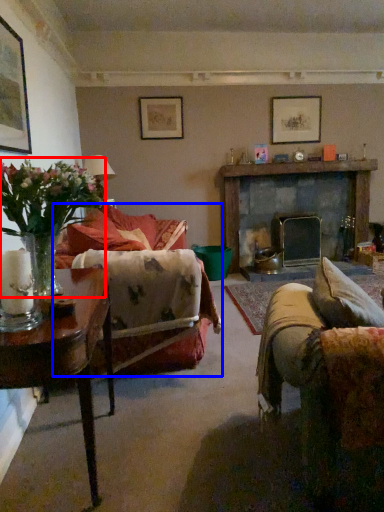
Question: Which object appears farthest to the camera in this image, houseplant (highlighted by a red box) or studio couch (highlighted by a blue box)?

Choices:
 (A) houseplant
 (B) studio couch

Answer: (B)